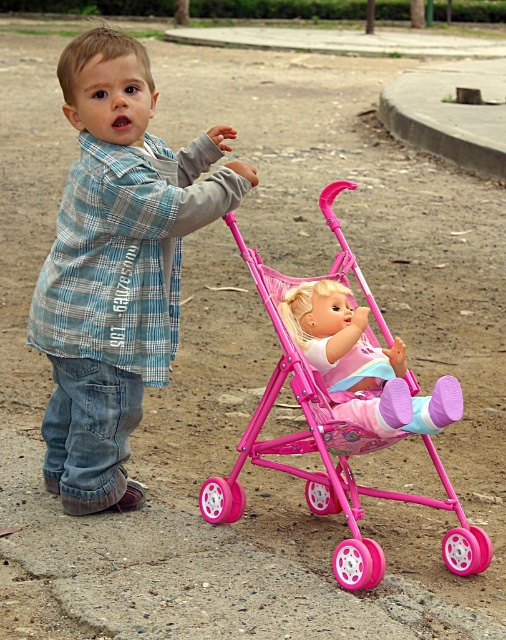
Question: Which point appears closest to the camera in this image?

Choices:
 (A) (66, 448)
 (B) (317, 476)

Answer: (B)

Question: From the image, what is the correct spatial relationship of pink plastic baby carriage at center in relation to pink plastic doll at center?

Choices:
 (A) below
 (B) above

Answer: (A)

Question: Which object is the closest to the pink plastic baby carriage at center?

Choices:
 (A) blue plaid shirt at center
 (B) pink plastic doll at center

Answer: (B)

Question: From the image, what is the correct spatial relationship of blue plaid shirt at center in relation to pink plastic doll at center?

Choices:
 (A) right
 (B) left

Answer: (B)

Question: Observing the image, what is the correct spatial positioning of pink plastic baby carriage at center in reference to pink plastic doll at center?

Choices:
 (A) right
 (B) left

Answer: (B)

Question: Which point is farther to the camera?

Choices:
 (A) pink plastic baby carriage at center
 (B) pink plastic doll at center
 (C) blue plaid shirt at center

Answer: (C)